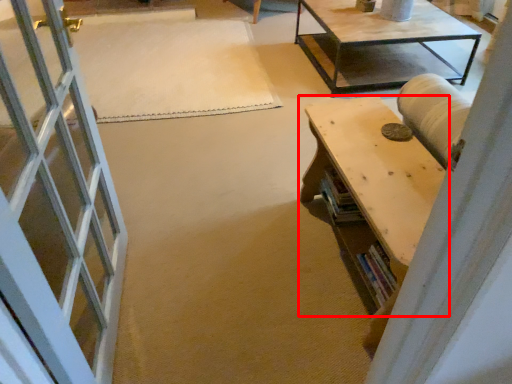
Question: Where is table (annotated by the red box) located in relation to mat in the image?

Choices:
 (A) left
 (B) right

Answer: (B)